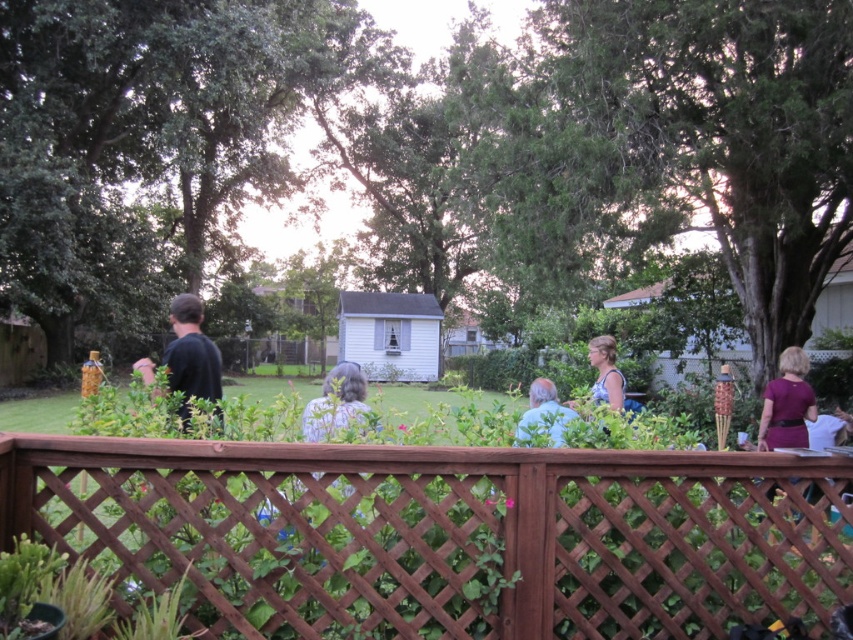
You are a photographer standing behind the wooden lattice fence in the foreground. You want to take a photo of both the dark blue shirt at left and gray hair at center in the same frame. Can you fit both subjects into your camera viewfinder without moving your position? The camera has a maximum horizontal field of view of 4 meters.

The dark blue shirt at left and gray hair at center are 3.79 meters apart, so yes, the photographer can fit both subjects into the camera viewfinder since the distance between them is less than the 4 meters maximum field of view.

You are standing at the point marked by the coordinates point (x=444, y=534) in the image. What object are you standing on?

The point (x=444, y=534) corresponds to the brown wooden fence at center.

You are a photographer trying to capture a group photo of the dark blue shirt at left and gray hair at center. To ensure both subjects are in focus, you need to know their relative positions. Which subject is positioned to the left side of the other?

The dark blue shirt at left is positioned to the left of gray hair at center.